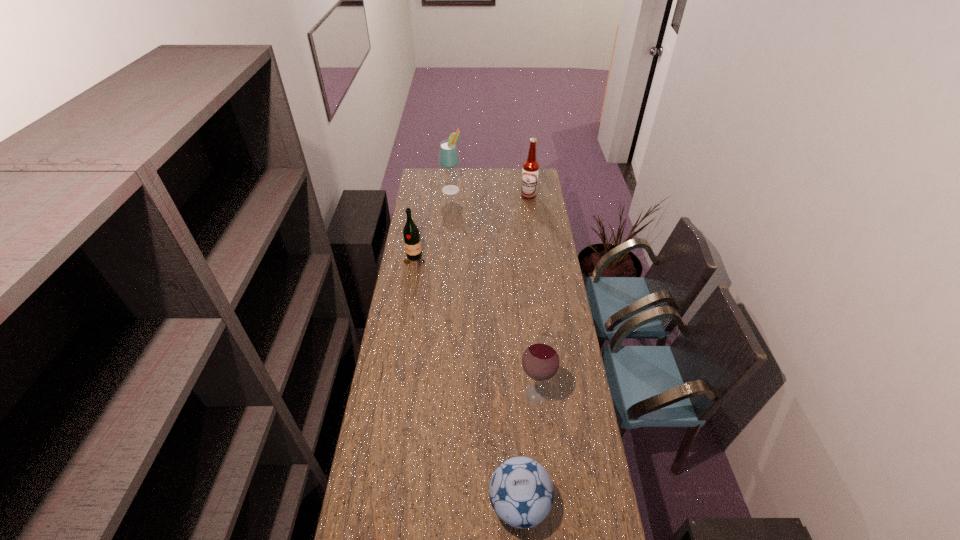
The image size is (960, 540). I want to click on vacant space situated 0.300m on the side with brand of the nearest object, so click(x=397, y=504).

This screenshot has width=960, height=540. What are the coordinates of `blank space located 0.350m on the side with brand of the nearest object` in the screenshot? It's located at (383, 504).

The width and height of the screenshot is (960, 540). In order to click on vacant space situated 0.290m on the side with brand of the nearest object in this screenshot , I will do `click(401, 504)`.

The height and width of the screenshot is (540, 960). Identify the location of object that is at the far edge. (448, 158).

You are a GUI agent. You are given a task and a screenshot of the screen. Output one action in this format:
    pyautogui.click(x=<x>, y=<y>)
    Task: Click on the alcohol that is at the left edge
    
    Given the screenshot: What is the action you would take?
    pyautogui.click(x=448, y=158)

The image size is (960, 540). I want to click on wine bottle that is at the left edge, so click(x=411, y=234).

Where is `object positioned at the far left corner`? object positioned at the far left corner is located at coordinates (448, 158).

Locate an element on the screen. vacant region at the far edge is located at coordinates (457, 184).

Locate an element on the screen. This screenshot has height=540, width=960. free space at the left edge of the desktop is located at coordinates (430, 229).

In the image, there is a desktop. Identify the location of free space at the right edge. The image size is (960, 540). (579, 474).